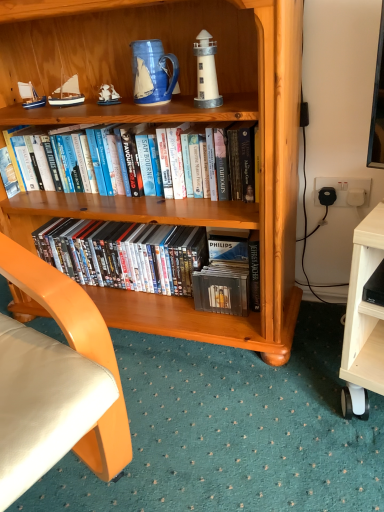
Question: From a real-world perspective, is wooden sailboat at upper left, the 1th sailboat when ordered from right to left, on top of wooden bookcase at center?

Choices:
 (A) yes
 (B) no

Answer: (A)

Question: Is wooden sailboat at upper left, which is the 2th sailboat from left to right, placed right next to wooden bookcase at center?

Choices:
 (A) yes
 (B) no

Answer: (B)

Question: Is the position of wooden sailboat at upper left, the 1th sailboat when ordered from right to left, less distant than that of wooden bookcase at center?

Choices:
 (A) yes
 (B) no

Answer: (B)

Question: Can you confirm if wooden sailboat at upper left, which is the 2th sailboat from left to right, is bigger than wooden bookcase at center?

Choices:
 (A) no
 (B) yes

Answer: (A)

Question: Is wooden bookcase at center located within wooden sailboat at upper left, which is the 2th sailboat from left to right?

Choices:
 (A) no
 (B) yes

Answer: (A)

Question: Based on their positions, is wooden bookcase at center located to the left or right of hardcover books at center, which is the 2th book in bottom-to-top order?

Choices:
 (A) right
 (B) left

Answer: (A)

Question: From a real-world perspective, is wooden bookcase at center positioned above or below hardcover books at center, positioned as the first book in top-to-bottom order?

Choices:
 (A) below
 (B) above

Answer: (A)

Question: Does point (292, 306) appear closer or farther from the camera than point (221, 166)?

Choices:
 (A) closer
 (B) farther

Answer: (B)

Question: Looking at their shapes, would you say wooden bookcase at center is wider or thinner than hardcover books at center, positioned as the first book in top-to-bottom order?

Choices:
 (A) wide
 (B) thin

Answer: (A)

Question: From a real-world perspective, is white matte lighthouse at upper center positioned above or below hardcover books at center, positioned as the first book in top-to-bottom order?

Choices:
 (A) above
 (B) below

Answer: (A)

Question: From the image's perspective, relative to hardcover books at center, which is the 2th book in bottom-to-top order, is white matte lighthouse at upper center above or below?

Choices:
 (A) below
 (B) above

Answer: (B)

Question: Visually, is white matte lighthouse at upper center positioned to the left or to the right of hardcover books at center, which is the 2th book in bottom-to-top order?

Choices:
 (A) right
 (B) left

Answer: (A)

Question: From their relative heights in the image, would you say white matte lighthouse at upper center is taller or shorter than hardcover books at center, positioned as the first book in top-to-bottom order?

Choices:
 (A) tall
 (B) short

Answer: (B)

Question: Is metallic silver dvds at lower center, which is the second book from top to bottom, bigger or smaller than wooden bookcase at center?

Choices:
 (A) small
 (B) big

Answer: (A)

Question: Considering the positions of metallic silver dvds at lower center, marked as the 1th book in a bottom-to-top arrangement, and wooden bookcase at center in the image, is metallic silver dvds at lower center, marked as the 1th book in a bottom-to-top arrangement, wider or thinner than wooden bookcase at center?

Choices:
 (A) thin
 (B) wide

Answer: (A)